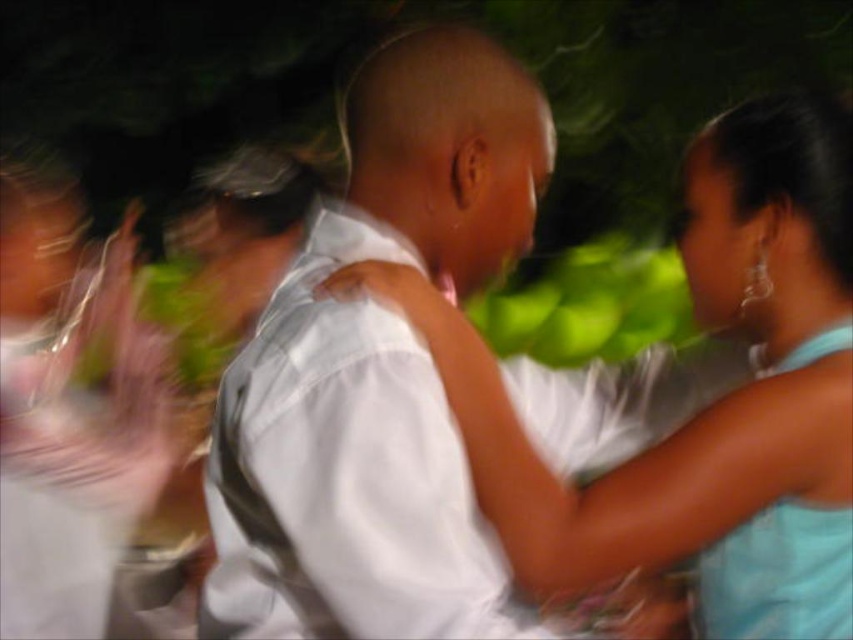
Can you confirm if light blue satin dress at center is wider than light blue satin dress at right?

Yes.

How far apart are light blue satin dress at center and light blue satin dress at right?

light blue satin dress at center is 4.23 inches from light blue satin dress at right.

Between point (364, 288) and point (796, 369), which one is positioned in front?

Point (364, 288)

Locate an element on the screen. light blue satin dress at center is located at coordinates (708, 406).

Which is above, white smooth shirt at center or light blue satin dress at center?

Positioned higher is light blue satin dress at center.

Who is positioned more to the right, white smooth shirt at center or light blue satin dress at center?

light blue satin dress at center is more to the right.

This screenshot has width=853, height=640. Describe the element at coordinates (376, 371) in the screenshot. I see `white smooth shirt at center` at that location.

Locate an element on the screen. white smooth shirt at center is located at coordinates (376, 371).

Can you confirm if white smooth shirt at center is bigger than light blue satin dress at right?

Yes, white smooth shirt at center is bigger than light blue satin dress at right.

Who is more forward, (316, 563) or (833, 515)?

Positioned in front is point (316, 563).

Identify the location of white smooth shirt at center. The image size is (853, 640). (376, 371).